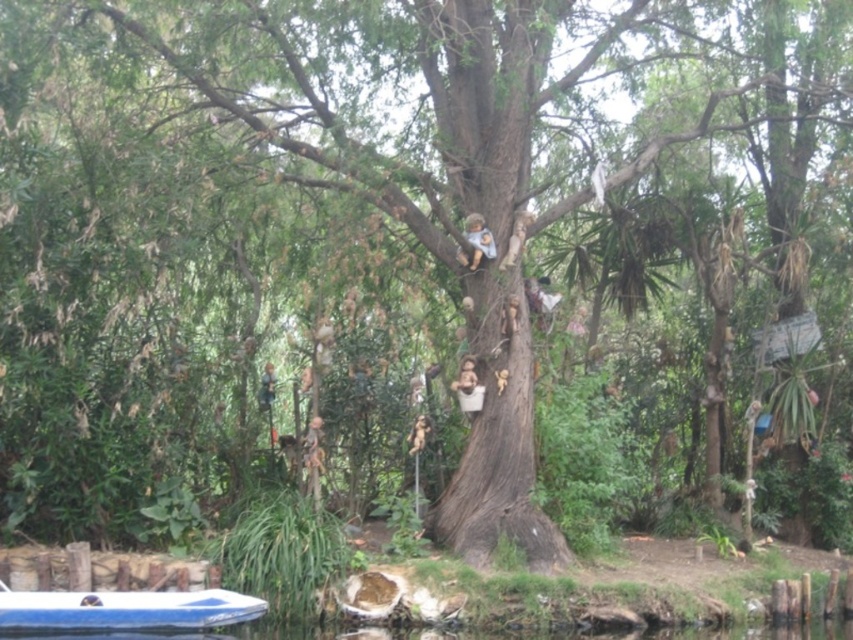
You are standing at the edge of the pond and see the blue plastic boat at lower left and the smooth beige doll at upper center. Which object is positioned to the left of the other?

The blue plastic boat at lower left is to the left of the smooth beige doll at upper center.

You are a visitor standing at the edge of the pond. You see the blue plastic boat at lower left and the smooth beige doll at upper center. Which object is closer to the water surface?

The blue plastic boat at lower left is closer to the water surface because it has a lesser height compared to the smooth beige doll at upper center.